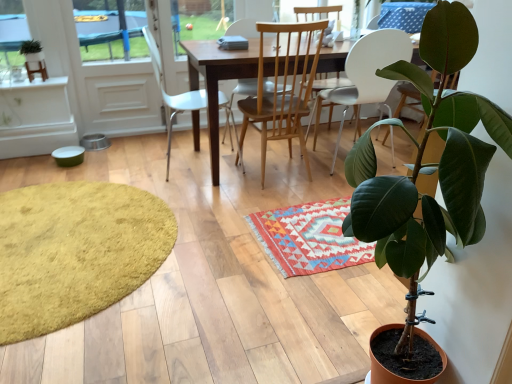
Question: From the image's perspective, is wooden table at center below light wood/wooden chair at center, which is counted as the 2th chair, starting from the right?

Choices:
 (A) yes
 (B) no

Answer: (B)

Question: Is wooden table at center closer to camera compared to light wood/wooden chair at center, which is counted as the 2th chair, starting from the right?

Choices:
 (A) no
 (B) yes

Answer: (A)

Question: Would you say wooden table at center is a long distance from light wood/wooden chair at center, acting as the 2th chair starting from the left?

Choices:
 (A) no
 (B) yes

Answer: (A)

Question: Does wooden table at center turn towards light wood/wooden chair at center, which is counted as the 2th chair, starting from the right?

Choices:
 (A) yes
 (B) no

Answer: (A)

Question: From a real-world perspective, is wooden table at center on top of light wood/wooden chair at center, which is counted as the 2th chair, starting from the right?

Choices:
 (A) no
 (B) yes

Answer: (A)

Question: Is yellow shaggy rug at lower left, which ranks as the 1th mat in left-to-right order, wider or thinner than wooden table at center?

Choices:
 (A) thin
 (B) wide

Answer: (B)

Question: From the image's perspective, is yellow shaggy rug at lower left, which appears as the second mat when viewed from the right, positioned above or below wooden table at center?

Choices:
 (A) below
 (B) above

Answer: (A)

Question: Considering their positions, is yellow shaggy rug at lower left, which appears as the second mat when viewed from the right, located in front of or behind wooden table at center?

Choices:
 (A) front
 (B) behind

Answer: (A)

Question: Considering the positions of yellow shaggy rug at lower left, which appears as the second mat when viewed from the right, and wooden table at center in the image, is yellow shaggy rug at lower left, which appears as the second mat when viewed from the right, taller or shorter than wooden table at center?

Choices:
 (A) short
 (B) tall

Answer: (A)

Question: Is wooden table at center situated inside yellow shaggy rug at lower left, which ranks as the 1th mat in left-to-right order, or outside?

Choices:
 (A) inside
 (B) outside

Answer: (B)

Question: From the image's perspective, is wooden table at center located above or below yellow shaggy rug at lower left, which appears as the second mat when viewed from the right?

Choices:
 (A) below
 (B) above

Answer: (B)

Question: In terms of height, does wooden table at center look taller or shorter compared to yellow shaggy rug at lower left, which appears as the second mat when viewed from the right?

Choices:
 (A) tall
 (B) short

Answer: (A)

Question: Considering the positions of wooden table at center and yellow shaggy rug at lower left, which ranks as the 1th mat in left-to-right order, in the image, is wooden table at center wider or thinner than yellow shaggy rug at lower left, which ranks as the 1th mat in left-to-right order,?

Choices:
 (A) thin
 (B) wide

Answer: (A)

Question: From the image's perspective, is wooden table at center positioned above or below green matte plant at upper left, the first houseplant from the top?

Choices:
 (A) above
 (B) below

Answer: (B)

Question: From a real-world perspective, is wooden table at center positioned above or below green matte plant at upper left, the 2th houseplant viewed from the front?

Choices:
 (A) below
 (B) above

Answer: (A)